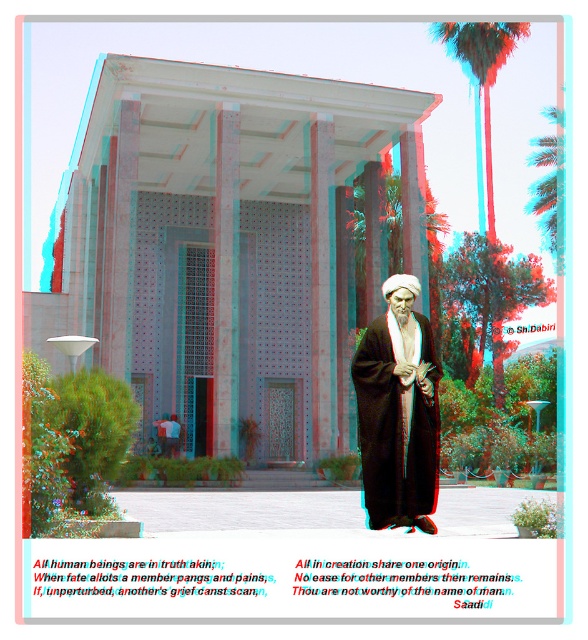
Is point (382, 436) less distant than point (514, 42)?

Yes, point (382, 436) is in front of point (514, 42).

Does brown matte robe at center appear over green leafy palm tree at upper right?

No.

In order to click on brown matte robe at center in this screenshot , I will do `click(397, 412)`.

The height and width of the screenshot is (640, 588). Identify the location of brown matte robe at center. (397, 412).